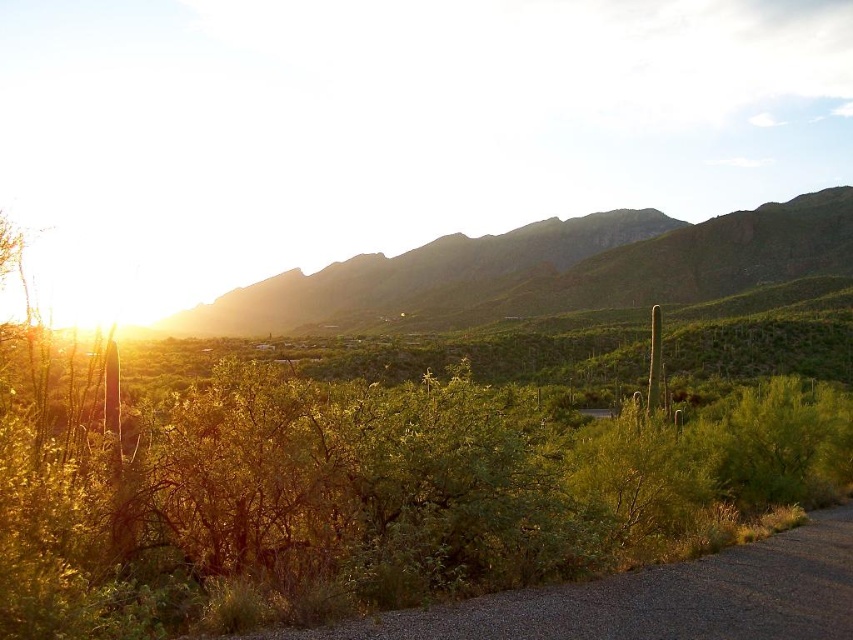
Question: Which of the following is the closest to the observer?

Choices:
 (A) green leafy bush at center
 (B) green rocky mountain at upper center

Answer: (A)

Question: Is green leafy bush at center smaller than green rocky mountain at upper center?

Choices:
 (A) no
 (B) yes

Answer: (B)

Question: Does green leafy bush at center appear under green rocky mountain at upper center?

Choices:
 (A) yes
 (B) no

Answer: (A)

Question: Is green leafy bush at center thinner than green rocky mountain at upper center?

Choices:
 (A) no
 (B) yes

Answer: (B)

Question: Among these points, which one is farthest from the camera?

Choices:
 (A) (225, 401)
 (B) (358, 257)

Answer: (B)